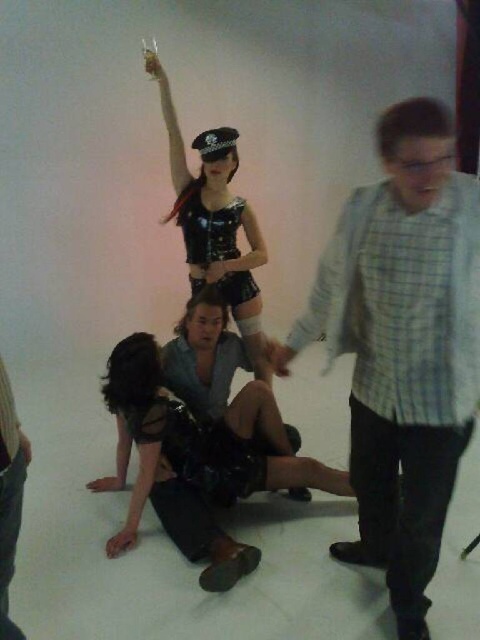
Question: Does shiny leather vest at center lie behind leather-like black dress at center?

Choices:
 (A) yes
 (B) no

Answer: (B)

Question: Which point is closer to the camera taking this photo?

Choices:
 (A) (212, 353)
 (B) (180, 225)
 (C) (195, 224)
 (D) (462, 323)

Answer: (D)

Question: Can you confirm if light blue plaid shirt at right is wider than leather-like black dress at center?

Choices:
 (A) yes
 (B) no

Answer: (A)

Question: Among these objects, which one is farthest from the camera?

Choices:
 (A) light blue plaid shirt at right
 (B) leather-like black dress at center
 (C) leather black dress at center
 (D) shiny leather vest at center

Answer: (B)

Question: Does light blue plaid shirt at right appear on the right side of leather black dress at center?

Choices:
 (A) no
 (B) yes

Answer: (B)

Question: Which point is farther to the camera?

Choices:
 (A) click(x=237, y=204)
 (B) click(x=176, y=172)

Answer: (A)